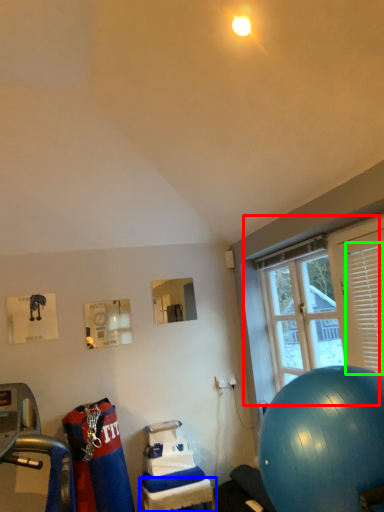
Question: Estimate the real-world distances between objects in this image. Which object is closer to window (highlighted by a red box), table (highlighted by a blue box) or shutter (highlighted by a green box)?

Choices:
 (A) table
 (B) shutter

Answer: (B)